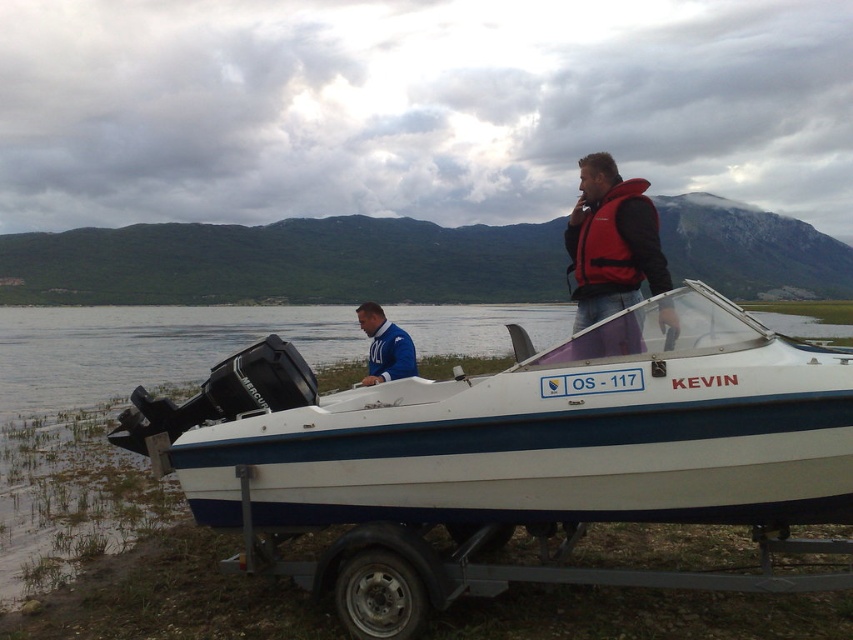
You are a safety inspector checking the boat and jackets. According to the image, which object is shorter between the white glossy boat at center and the blue fleece jacket at center?

The white glossy boat at center is not as tall as the blue fleece jacket at center, so the boat is shorter.